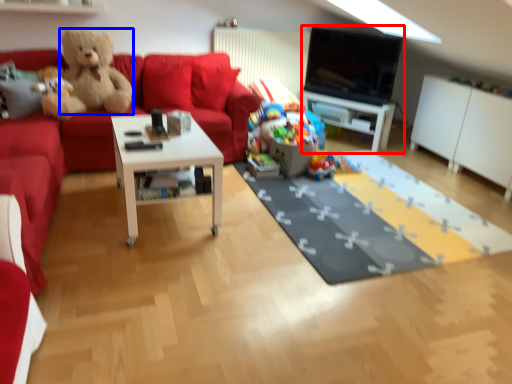
Question: Which point is closer to the camera, entertainment center (highlighted by a red box) or teddy bear (highlighted by a blue box)?

Choices:
 (A) entertainment center
 (B) teddy bear

Answer: (B)